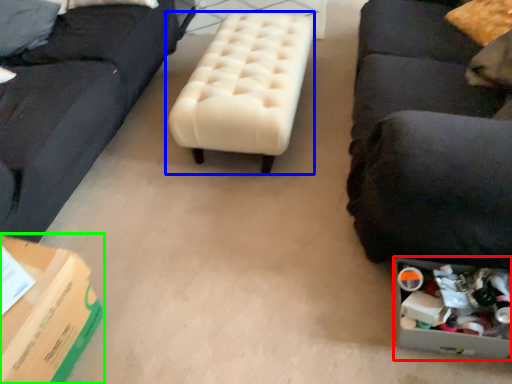
Question: Which object is positioned farthest from storage box (highlighted by a red box)? Select from table (highlighted by a blue box) and cardboard box (highlighted by a green box).

Choices:
 (A) table
 (B) cardboard box

Answer: (B)